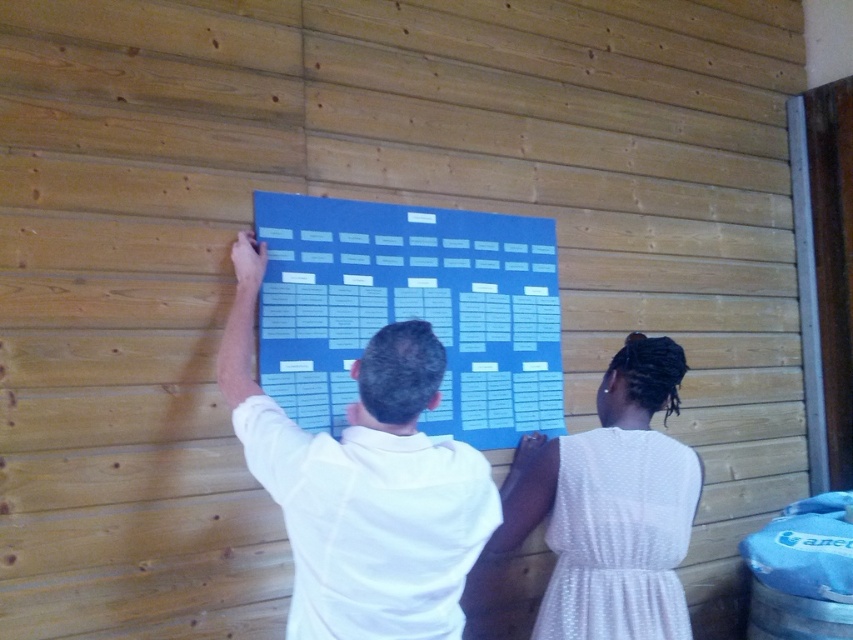
Looking at this image, you are a photographer standing in front of the wooden wall. You need to capture a photo of both the blue paperboard at center and the white dotted dress at center without any obstruction. Based on their positions, which object should you focus on first to ensure both are in frame?

The blue paperboard at center is to the left of the white dotted dress at center, so you should focus on the blue paperboard at center first to ensure both are in frame.

You are a photographer standing behind the two people in the image. You want to take a photo that clearly shows both the white matte shirt at center and the white dotted dress at center without any obstruction. Is it possible to adjust your position so that neither of them blocks the other?

The white matte shirt at center is in front of the white dotted dress at center, so adjusting your position might not fully eliminate the obstruction. However, moving slightly to the side could allow you to capture both individuals without one completely blocking the other.

You are standing in front of the wooden wall where the two people are hanging a large blue poster. There is a point at coordinates [410,308]. What object is located at this point?

The point at coordinates [410,308] marks the blue paperboard at center.